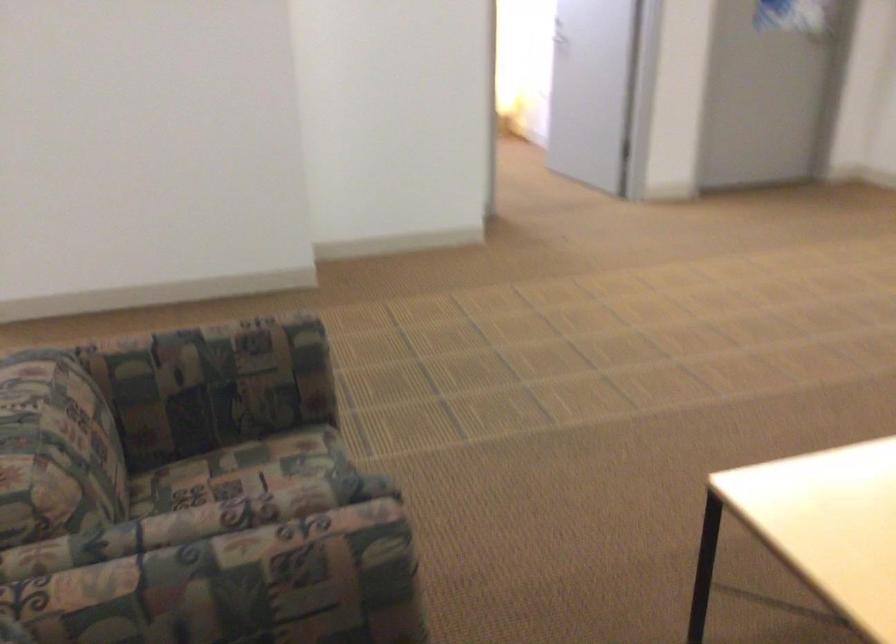
This screenshot has height=644, width=896. Describe the element at coordinates (254, 468) in the screenshot. I see `the sofa sitting surface` at that location.